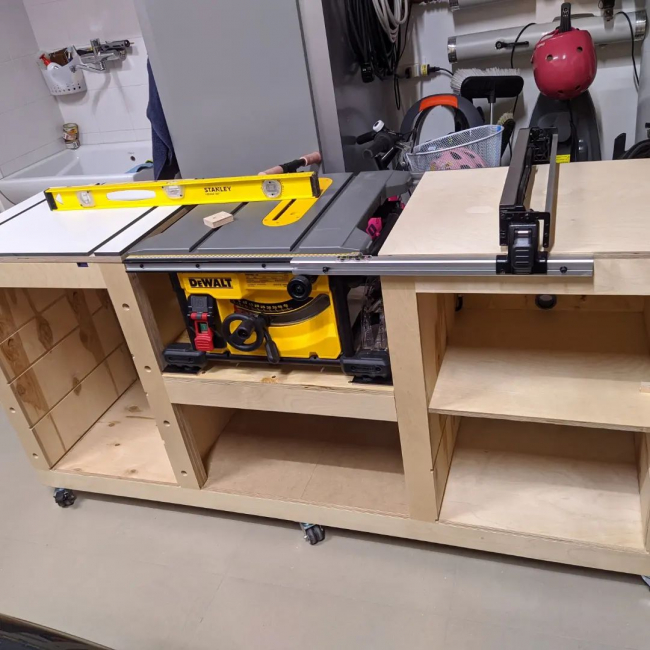
The height and width of the screenshot is (650, 650). I want to click on cords, so click(376, 31).